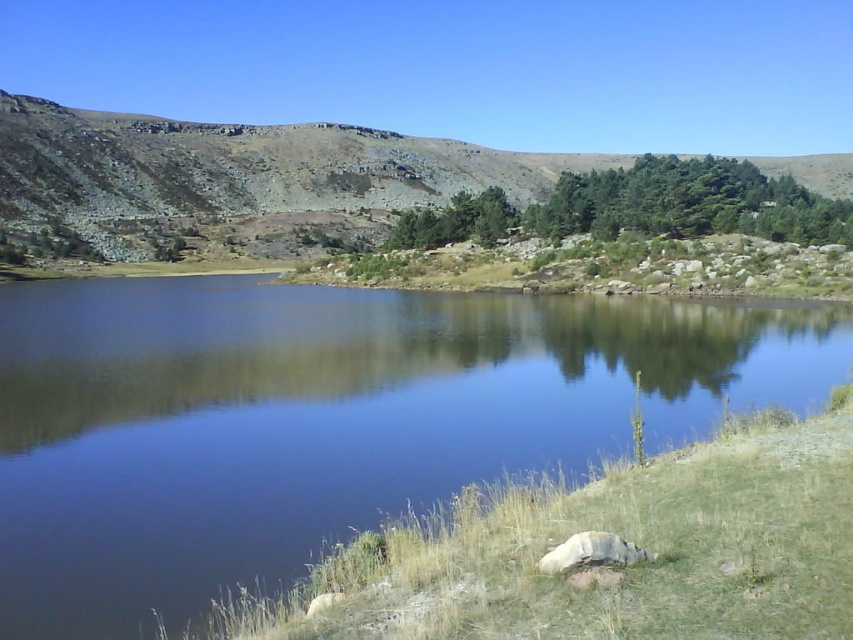
Question: Does green grass at lower right have a greater width compared to dull brown rock at upper left?

Choices:
 (A) no
 (B) yes

Answer: (A)

Question: Can you confirm if green grass at lower right is positioned below dull brown rock at upper left?

Choices:
 (A) no
 (B) yes

Answer: (B)

Question: Is green grass at lower right further to camera compared to dull brown rock at upper left?

Choices:
 (A) no
 (B) yes

Answer: (A)

Question: Which point is farther to the camera?

Choices:
 (A) green grass at lower right
 (B) dull brown rock at upper left

Answer: (B)